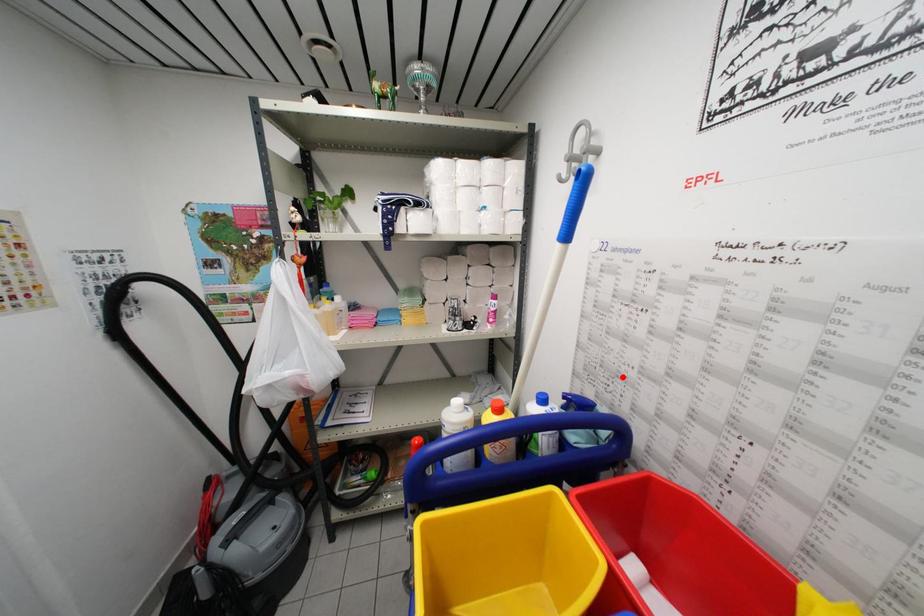
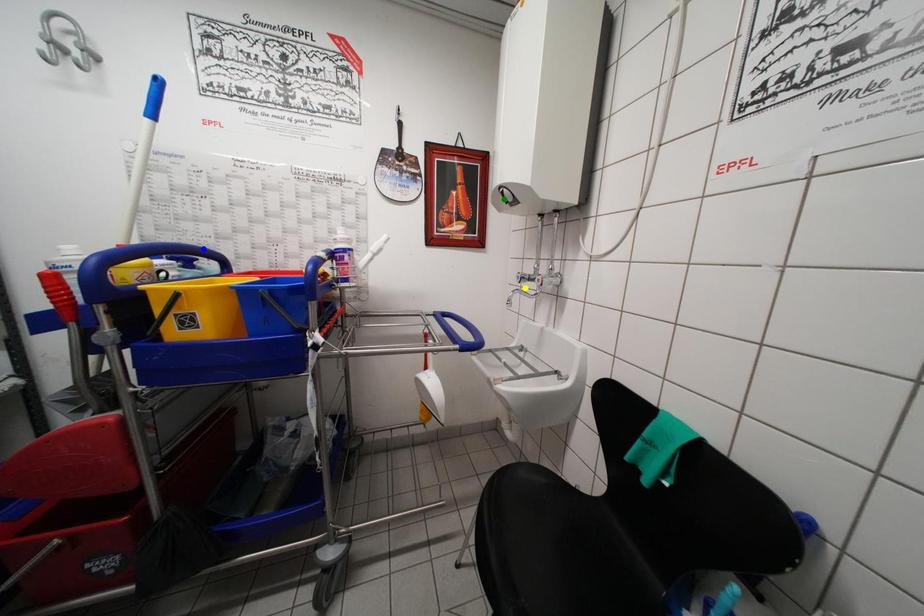
Question: I am providing you with two images of the same scene from different viewpoints. A red point is marked on the first image. You are given multiple points on the second image. Which point in image 2 is actually the same real-world point as the red point in image 1?

Choices:
 (A) yellow point
 (B) blue point
 (C) green point

Answer: (B)